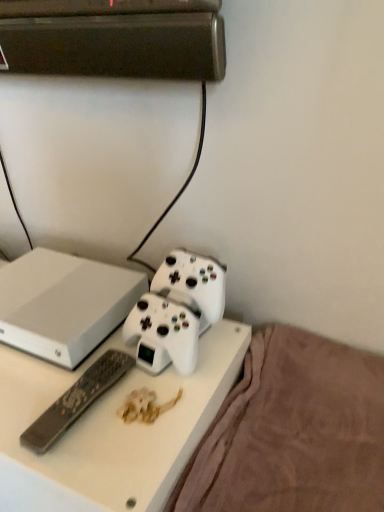
This screenshot has width=384, height=512. Describe the element at coordinates (176, 311) in the screenshot. I see `white matte game controller at center` at that location.

What is the approximate height of brown plush blanket at lower right?

The height of brown plush blanket at lower right is 5.83 inches.

Identify the location of black plastic remote at lower left. (76, 400).

Looking at this image, is white matte game controller at center at the back of brown plush blanket at lower right?

brown plush blanket at lower right is not turned away from white matte game controller at center.

Is brown plush blanket at lower right not within white matte game controller at center?

brown plush blanket at lower right is positioned outside white matte game controller at center.

Which object is positioned more to the left, brown plush blanket at lower right or white matte game controller at center?

Positioned to the left is white matte game controller at center.

Is white matte gaming console at center facing away from brown plush blanket at lower right?

No, white matte gaming console at center is not facing away from brown plush blanket at lower right.

From a real-world perspective, does white matte gaming console at center stand above brown plush blanket at lower right?

Yes, from a real-world perspective, white matte gaming console at center is on top of brown plush blanket at lower right.

Based on the photo, is white matte gaming console at center next to brown plush blanket at lower right and touching it?

white matte gaming console at center is not next to brown plush blanket at lower right, and they're not touching.

From the image's perspective, is white matte game controller at center over white matte gaming console at center?

Incorrect, from the image's perspective, white matte game controller at center is lower than white matte gaming console at center.

Is white matte game controller at center bigger than white matte gaming console at center?

Incorrect, white matte game controller at center is not larger than white matte gaming console at center.

From a real-world perspective, which object stands above the other?

white matte game controller at center is physically above.

Is white matte game controller at center oriented away from white matte gaming console at center?

white matte game controller at center does not have its back to white matte gaming console at center.

From the picture: Is brown plush blanket at lower right touching white plastic desk at center?

They are not placed beside each other.

Is point (292, 440) positioned after point (170, 430)?

That is True.

Which of these two, brown plush blanket at lower right or white plastic desk at center, is wider?

Wider between the two is brown plush blanket at lower right.

From the image's perspective, which one is positioned lower, white matte gaming console at center or white matte game controller at center?

white matte game controller at center.

Is white matte gaming console at center positioned with its back to white matte game controller at center?

No, white matte gaming console at center's orientation is not away from white matte game controller at center.

Can you tell me how much white matte gaming console at center and white matte game controller at center differ in facing direction?

7.7 degrees.

Between point (67, 315) and point (192, 335), which one is positioned in front?

Point (192, 335)

Is white plastic desk at center smaller than brown plush blanket at lower right?

No.

Consider the image. Is white plastic desk at center oriented away from brown plush blanket at lower right?

white plastic desk at center is not turned away from brown plush blanket at lower right.

Which is behind, white plastic desk at center or brown plush blanket at lower right?

white plastic desk at center is further from the camera.

From a real-world perspective, is white matte game controller at center below brown plush blanket at lower right?

Actually, white matte game controller at center is physically above brown plush blanket at lower right in the real world.

Considering the relative positions of white matte game controller at center and brown plush blanket at lower right in the image provided, is white matte game controller at center behind brown plush blanket at lower right?

Yes, it is behind brown plush blanket at lower right.

Identify the location of bedding lying below the white matte game controller at center (from the image's perspective). (293, 431).

Is point (207, 282) positioned in front of point (244, 466)?

No, it is not.

Locate an element on the screen. equipment above the brown plush blanket at lower right (from a real-world perspective) is located at coordinates click(176, 311).

You are a GUI agent. You are given a task and a screenshot of the screen. Output one action in this format:
    pyautogui.click(x=<x>, y=<y>)
    Task: Click on the bedding below the white matte gaming console at center (from the image's perspective)
    
    Given the screenshot: What is the action you would take?
    (293, 431)

Looking at the image, which one is located closer to brown plush blanket at lower right, white matte game controller at center or black plastic remote at lower left?

The object closer to brown plush blanket at lower right is white matte game controller at center.

When comparing their distances from black plastic remote at lower left, does white matte game controller at center or white matte gaming console at center seem further?

white matte gaming console at center is positioned further to the anchor black plastic remote at lower left.

Estimate the real-world distances between objects in this image. Which object is further from white plastic desk at center, white matte game controller at center or brown plush blanket at lower right?

Among the two, brown plush blanket at lower right is located further to white plastic desk at center.

Considering their positions, is white matte gaming console at center positioned further to brown plush blanket at lower right than white matte game controller at center?

white matte gaming console at center lies further to brown plush blanket at lower right than the other object.

Based on their spatial positions, is white plastic desk at center or black plastic remote at lower left further from white matte game controller at center?

white plastic desk at center is positioned further to the anchor white matte game controller at center.

Based on their spatial positions, is black plastic remote at lower left or white matte game controller at center closer to white matte gaming console at center?

white matte game controller at center is closer to white matte gaming console at center.

Which object lies nearer to the anchor point brown plush blanket at lower right, white plastic desk at center or white matte gaming console at center?

white plastic desk at center is positioned closer to the anchor brown plush blanket at lower right.

When comparing their distances from brown plush blanket at lower right, does black plastic remote at lower left or white plastic desk at center seem further?

Based on the image, black plastic remote at lower left appears to be further to brown plush blanket at lower right.

Image resolution: width=384 pixels, height=512 pixels. Identify the location of remote control between white matte gaming console at center and white plastic desk at center from top to bottom. (76, 400).

The width and height of the screenshot is (384, 512). In order to click on remote control situated between white plastic desk at center and brown plush blanket at lower right from left to right in this screenshot , I will do `click(76, 400)`.

Identify the location of computer between white plastic desk at center and brown plush blanket at lower right. (64, 304).

At what (x,y) coordinates should I click in order to perform the action: click on equipment between black plastic remote at lower left and brown plush blanket at lower right from left to right. Please return your answer as a coordinate pair (x, y). Looking at the image, I should click on (176, 311).